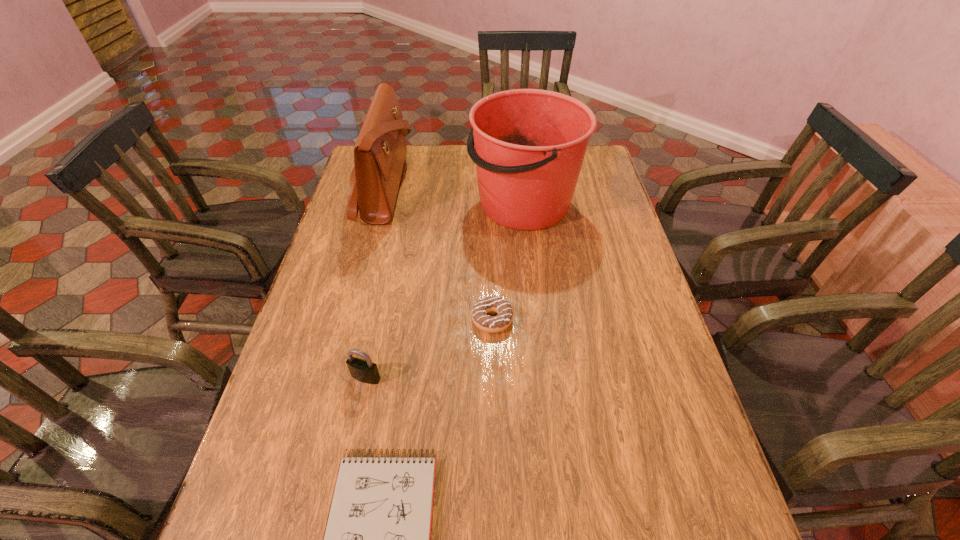
This screenshot has width=960, height=540. In order to click on free location that satisfies the following two spatial constraints: 1. on the front flap of the padlock; 2. on the right side of the satchel in this screenshot , I will do `click(334, 377)`.